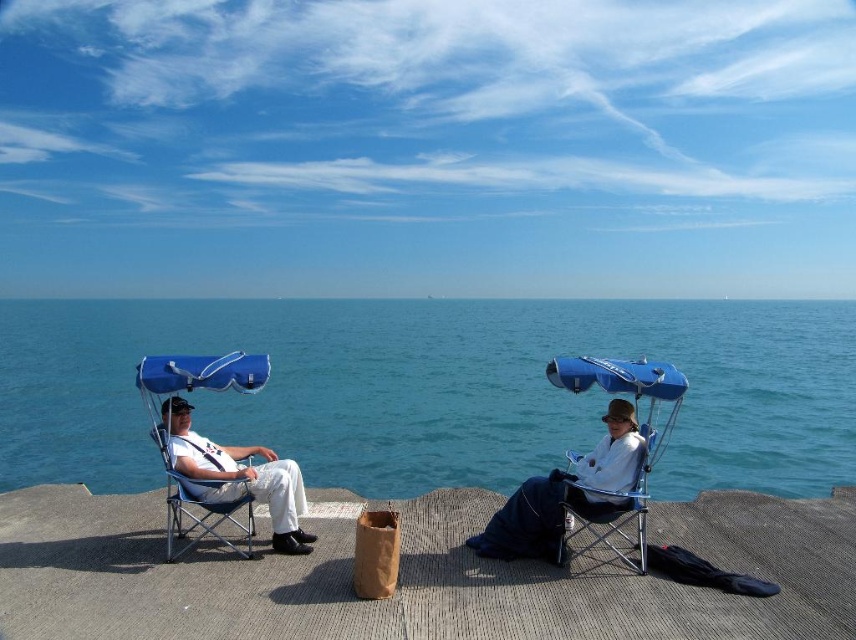
Question: Is blue fabric beach chair at center to the left of matte blue folding chair at left from the viewer's perspective?

Choices:
 (A) no
 (B) yes

Answer: (A)

Question: Among these points, which one is nearest to the camera?

Choices:
 (A) (168, 440)
 (B) (661, 381)
 (C) (296, 522)
 (D) (593, 492)

Answer: (B)

Question: Which of the following is the farthest from the observer?

Choices:
 (A) concrete dock at center
 (B) blue water at center

Answer: (A)

Question: Which object appears farthest from the camera in this image?

Choices:
 (A) white cotton shirt at center
 (B) concrete dock at center

Answer: (B)

Question: Can you confirm if blue fabric beach chair at center is positioned above matte blue folding chair at center?

Choices:
 (A) yes
 (B) no

Answer: (A)

Question: Does white matte pants at left have a smaller size compared to matte blue folding chair at left?

Choices:
 (A) yes
 (B) no

Answer: (A)